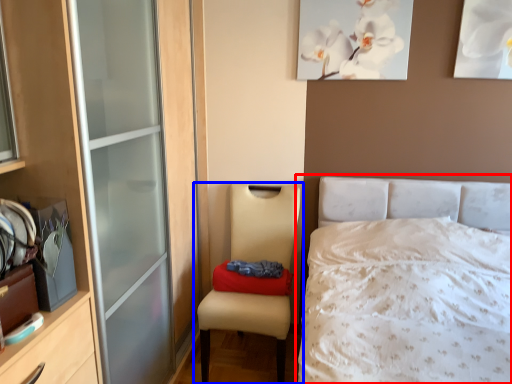
Question: Among these objects, which one is farthest to the camera, bed (highlighted by a red box) or chair (highlighted by a blue box)?

Choices:
 (A) bed
 (B) chair

Answer: (B)